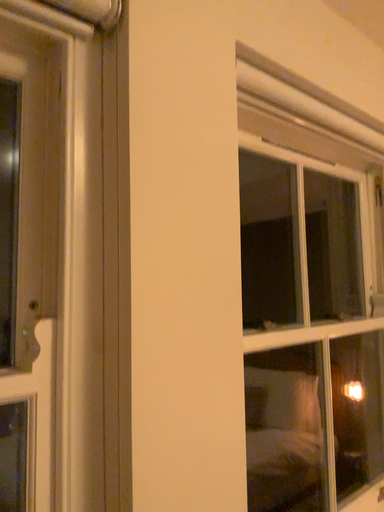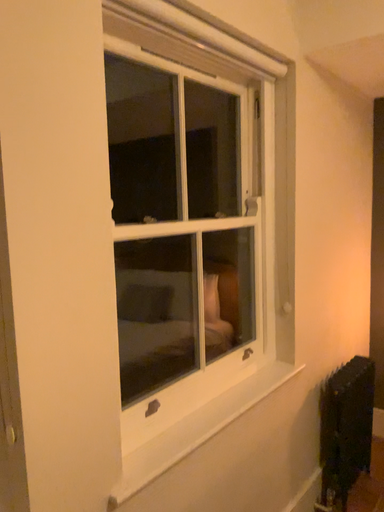
Question: How did the camera likely rotate when shooting the video?

Choices:
 (A) rotated left
 (B) rotated right

Answer: (B)